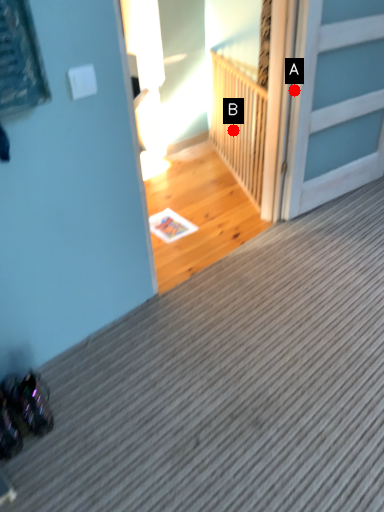
Question: Two points are circled on the image, labeled by A and B beside each circle. Which point is closer to the camera?

Choices:
 (A) A is closer
 (B) B is closer

Answer: (A)